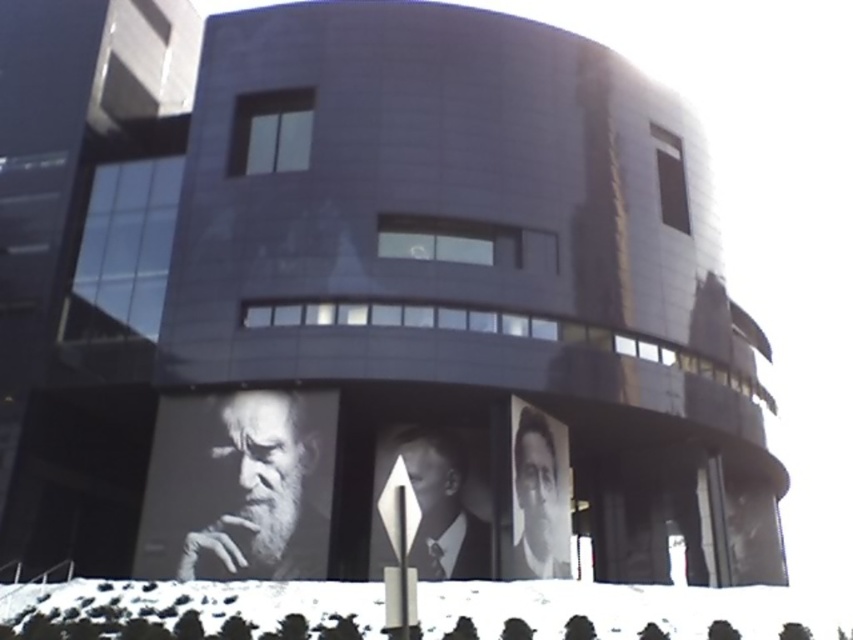
You are an art student analyzing the portraits on the building. You notice two portraits, the black and white portrait at center and the black and white portrait at lower right. Which one has a smaller height?

The black and white portrait at center is not as tall as the black and white portrait at lower right, so the black and white portrait at center has a smaller height.

You are an art student analyzing the modern building with portraits. Which of the two portraits, the black and white portrait at lower left or the black and white portrait at lower right, is taller?

The black and white portrait at lower right is taller than the black and white portrait at lower left.